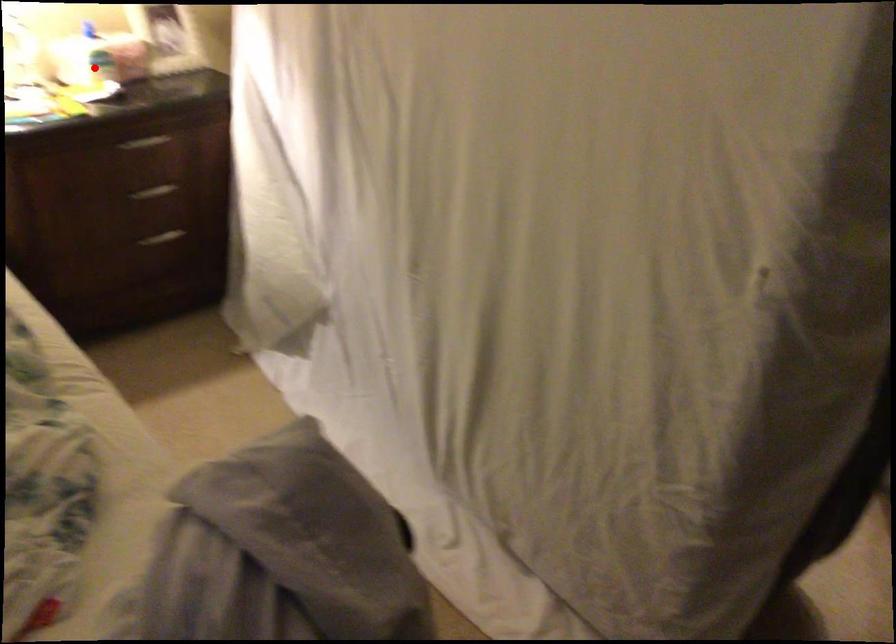
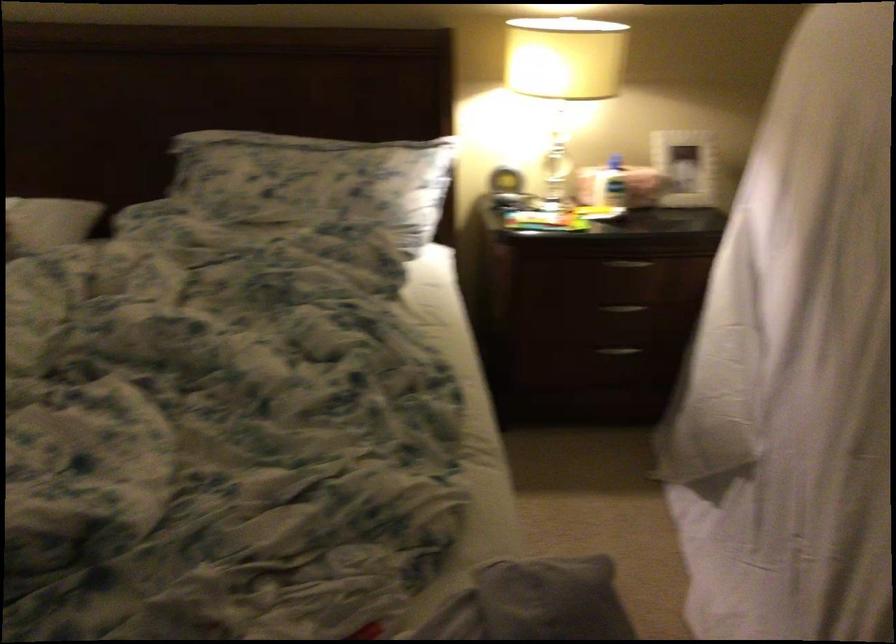
The point at the highlighted location is marked in the first image. Where is the corresponding point in the second image?

(609, 184)